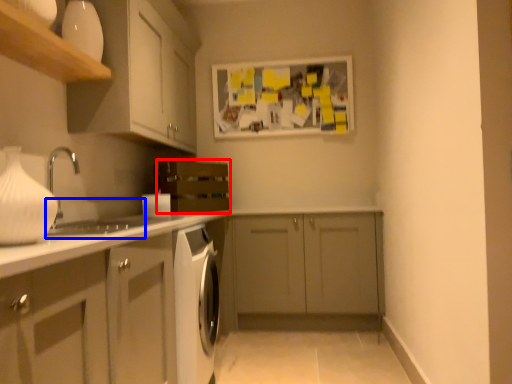
Question: Which point is closer to the camera, oven (highlighted by a red box) or sink (highlighted by a blue box)?

Choices:
 (A) oven
 (B) sink

Answer: (B)